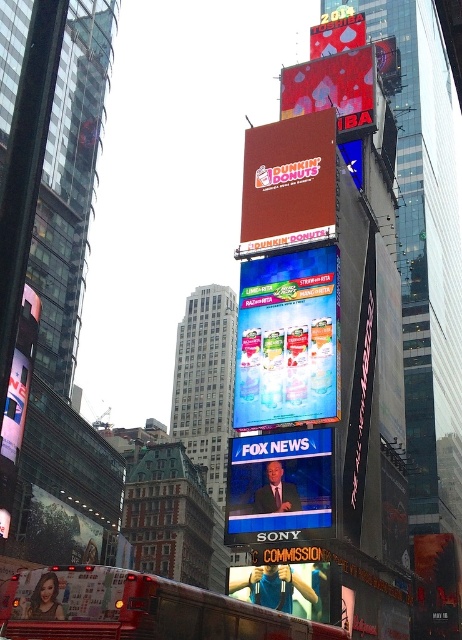
Can you confirm if shiny plastic bottles at center is wider than blue fabric at lower center?

Correct, the width of shiny plastic bottles at center exceeds that of blue fabric at lower center.

Who is positioned more to the right, shiny plastic bottles at center or blue fabric at lower center?

From the viewer's perspective, shiny plastic bottles at center appears more on the right side.

Who is more distant from viewer, (x=312, y=365) or (x=265, y=595)?

Positioned behind is point (x=312, y=365).

This screenshot has width=462, height=640. I want to click on shiny plastic bottles at center, so click(x=287, y=340).

Can you confirm if matte black bus at left is wider than red fabric sign at upper center?

Indeed, matte black bus at left has a greater width compared to red fabric sign at upper center.

Is matte black bus at left taller than red fabric sign at upper center?

Indeed, matte black bus at left has a greater height compared to red fabric sign at upper center.

Which is behind, point (20, 412) or point (358, 45)?

The point (358, 45) is behind.

The width and height of the screenshot is (462, 640). What are the coordinates of `matte black bus at left` in the screenshot? It's located at (19, 376).

Which of these two, shiny plastic bottles at center or shiny red billboard at upper center, stands taller?

shiny plastic bottles at center is taller.

How much distance is there between shiny plastic bottles at center and shiny red billboard at upper center?

A distance of 17.60 meters exists between shiny plastic bottles at center and shiny red billboard at upper center.

Measure the distance between point (277, 337) and camera.

Point (277, 337) and camera are 141.55 feet apart.

The width and height of the screenshot is (462, 640). I want to click on shiny plastic bottles at center, so click(287, 340).